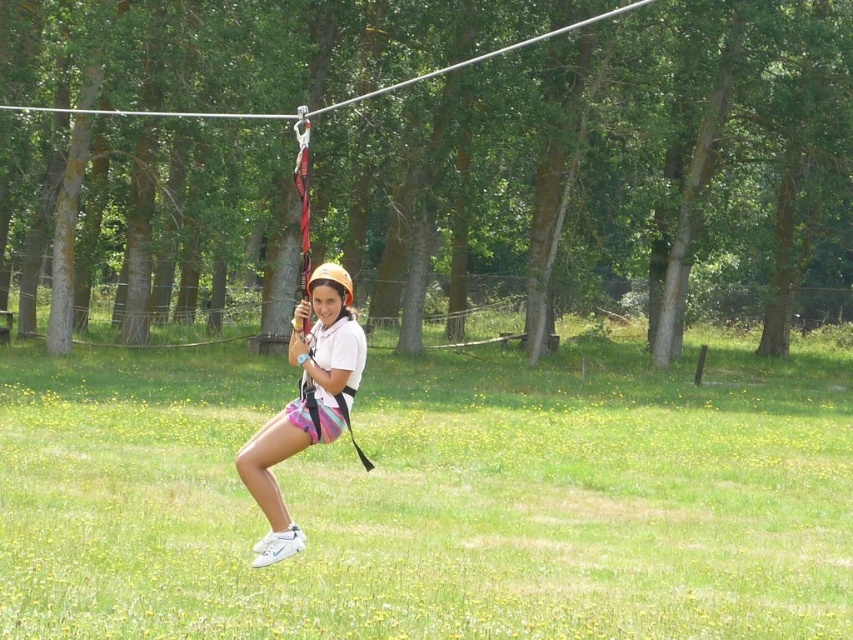
You are a drone operator trying to capture a photo of the zip liner. You need to ensure the green grassy field at center and the white matte helmet at center are both in frame. Which object should you adjust your camera focus on to ensure both are visible?

The green grassy field at center is wider than the white matte helmet at center, so focusing on the green grassy field at center would ensure both are in frame.

You are a safety inspector checking the zip line setup. The brown wood tree at center is part of the zip line structure. According to safety regulations, the minimum safe distance between the camera and the tree supporting the zip line must be at least 8 meters. Is the current setup compliant with safety standards?

The brown wood tree at center is 7.65 meters from the camera, which is less than the required 8 meters. Therefore, the current setup does not comply with safety standards.